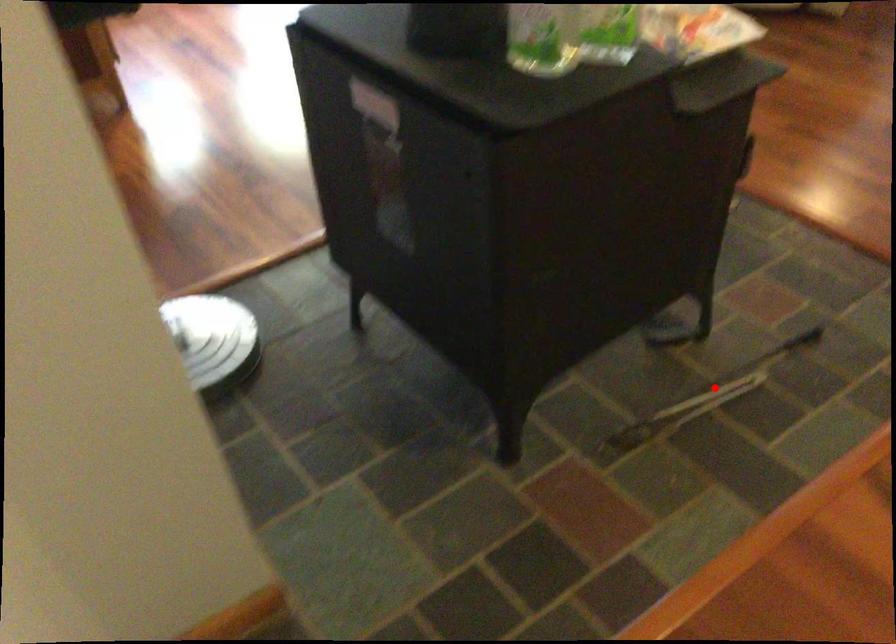
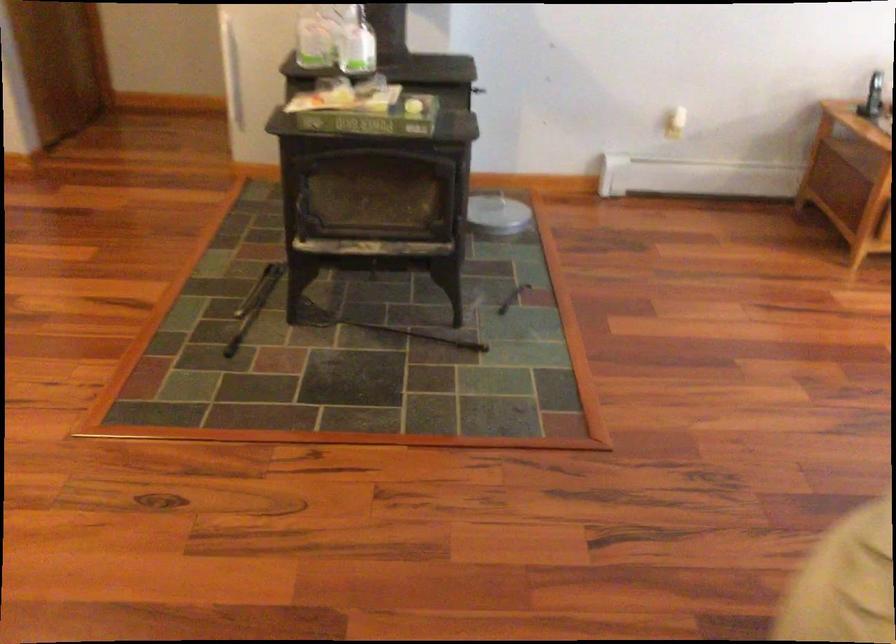
Question: I am providing you with two images of the same scene from different viewpoints. In image1, a red point is highlighted. Considering the same 3D point in image2, which of the following is correct?

Choices:
 (A) It is closer
 (B) It is farther

Answer: (B)